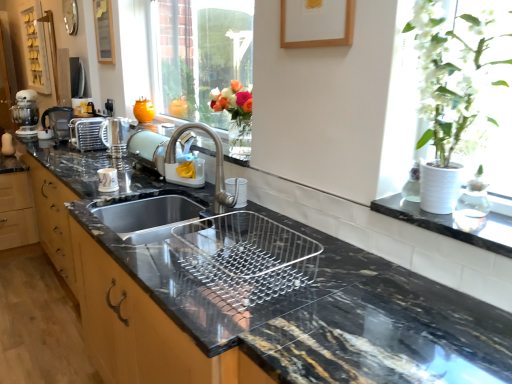
Question: Is orange matte vase at upper center completely or partially inside metallic silver toaster at upper left, which is the second appliance from front to back?

Choices:
 (A) no
 (B) yes

Answer: (A)

Question: Considering the relative positions of metallic silver toaster at upper left, marked as the first appliance in a back-to-front arrangement, and orange matte vase at upper center in the image provided, is metallic silver toaster at upper left, marked as the first appliance in a back-to-front arrangement, to the right of orange matte vase at upper center from the viewer's perspective?

Choices:
 (A) no
 (B) yes

Answer: (A)

Question: Would you say metallic silver toaster at upper left, arranged as the 1th appliance when viewed from the left, is outside orange matte vase at upper center?

Choices:
 (A) yes
 (B) no

Answer: (A)

Question: Is the position of metallic silver toaster at upper left, arranged as the 1th appliance when viewed from the left, more distant than that of orange matte vase at upper center?

Choices:
 (A) yes
 (B) no

Answer: (B)

Question: Considering the relative sizes of metallic silver toaster at upper left, marked as the first appliance in a back-to-front arrangement, and orange matte vase at upper center in the image provided, is metallic silver toaster at upper left, marked as the first appliance in a back-to-front arrangement, shorter than orange matte vase at upper center?

Choices:
 (A) yes
 (B) no

Answer: (B)

Question: From the image's perspective, is orange matte vase at upper center located above or below satin nickel faucet at center?

Choices:
 (A) below
 (B) above

Answer: (B)

Question: From a real-world perspective, is orange matte vase at upper center physically located above or below satin nickel faucet at center?

Choices:
 (A) below
 (B) above

Answer: (B)

Question: Do you think orange matte vase at upper center is within satin nickel faucet at center, or outside of it?

Choices:
 (A) outside
 (B) inside

Answer: (A)

Question: Looking at their shapes, would you say orange matte vase at upper center is wider or thinner than satin nickel faucet at center?

Choices:
 (A) wide
 (B) thin

Answer: (B)

Question: In terms of width, does white matte vase at upper right look wider or thinner when compared to wooden picture frame at upper left, placed as the 2th picture frame when sorted from right to left?

Choices:
 (A) thin
 (B) wide

Answer: (B)

Question: Is point (439, 157) closer or farther from the camera than point (98, 61)?

Choices:
 (A) farther
 (B) closer

Answer: (B)

Question: Based on their sizes in the image, would you say white matte vase at upper right is bigger or smaller than wooden picture frame at upper left, placed as the 2th picture frame when sorted from right to left?

Choices:
 (A) small
 (B) big

Answer: (B)

Question: Considering the positions of white matte vase at upper right and wooden picture frame at upper left, arranged as the first picture frame when viewed from the back, in the image, is white matte vase at upper right taller or shorter than wooden picture frame at upper left, arranged as the first picture frame when viewed from the back,?

Choices:
 (A) short
 (B) tall

Answer: (B)

Question: In terms of height, does metallic silver coffee machine at left look taller or shorter compared to wooden picture frame at upper left, which ranks as the first picture frame in top-to-bottom order?

Choices:
 (A) short
 (B) tall

Answer: (A)

Question: In the image, is metallic silver coffee machine at left positioned in front of or behind wooden picture frame at upper left, positioned as the second picture frame in bottom-to-top order?

Choices:
 (A) front
 (B) behind

Answer: (B)